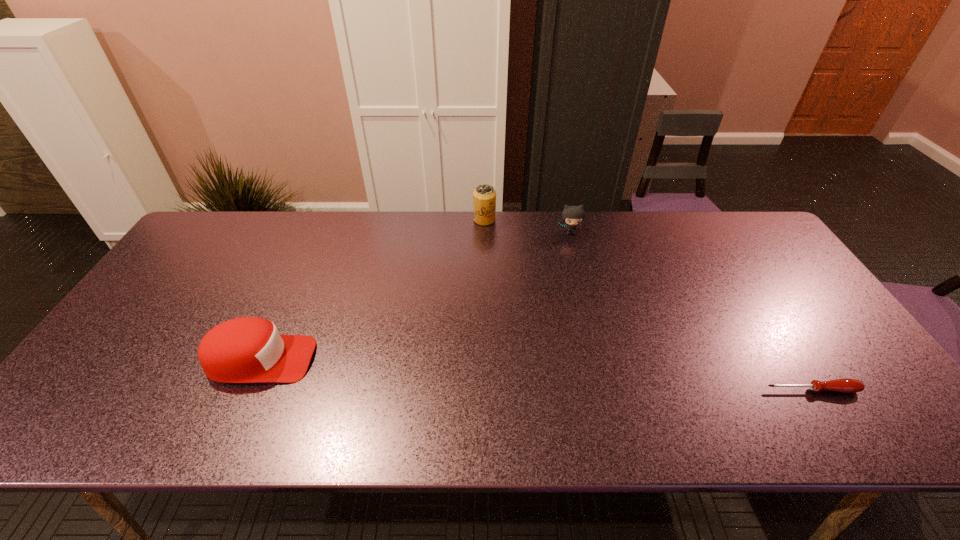
Locate an element on the screen. the tallest object is located at coordinates (484, 196).

At what (x,y) coordinates should I click in order to perform the action: click on beer can. Please return your answer as a coordinate pair (x, y). The image size is (960, 540). Looking at the image, I should click on (484, 196).

Where is `the leftmost object`? The image size is (960, 540). the leftmost object is located at coordinates (248, 349).

Locate an element on the screen. The height and width of the screenshot is (540, 960). the second farthest object is located at coordinates pos(572,215).

You are a GUI agent. You are given a task and a screenshot of the screen. Output one action in this format:
    pyautogui.click(x=<x>, y=<y>)
    Task: Click on the kitten
    
    Given the screenshot: What is the action you would take?
    pyautogui.click(x=572, y=215)

You are a GUI agent. You are given a task and a screenshot of the screen. Output one action in this format:
    pyautogui.click(x=<x>, y=<y>)
    Task: Click on the screwdriver
    
    Given the screenshot: What is the action you would take?
    pyautogui.click(x=844, y=385)

At what (x,y) coordinates should I click in order to perform the action: click on the shortest object. Please return your answer as a coordinate pair (x, y). Image resolution: width=960 pixels, height=540 pixels. Looking at the image, I should click on (844, 385).

Where is `vacant position located 0.170m on the front of the second object from left to right`? The height and width of the screenshot is (540, 960). vacant position located 0.170m on the front of the second object from left to right is located at coordinates (485, 259).

Find the location of a particular element. vacant space located 0.260m on the front-facing side of the baseball cap is located at coordinates (419, 360).

Locate an element on the screen. free spot located 0.220m on the front-facing side of the third nearest object is located at coordinates (583, 285).